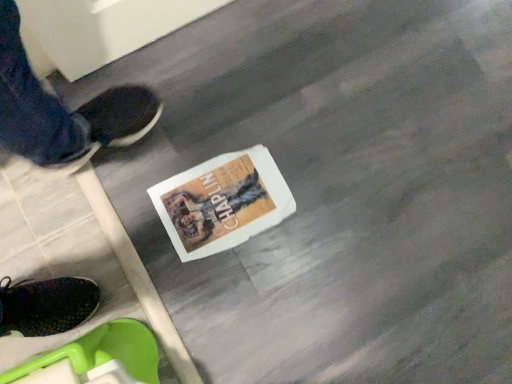
The image size is (512, 384). I want to click on blank area beneath white paper magazine at center (from a real-world perspective), so click(x=216, y=198).